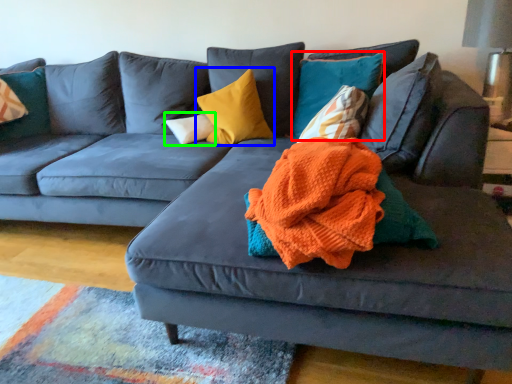
Question: Which object is positioned farthest from pillow (highlighted by a red box)? Select from pillow (highlighted by a blue box) and pillow (highlighted by a green box).

Choices:
 (A) pillow
 (B) pillow

Answer: (B)